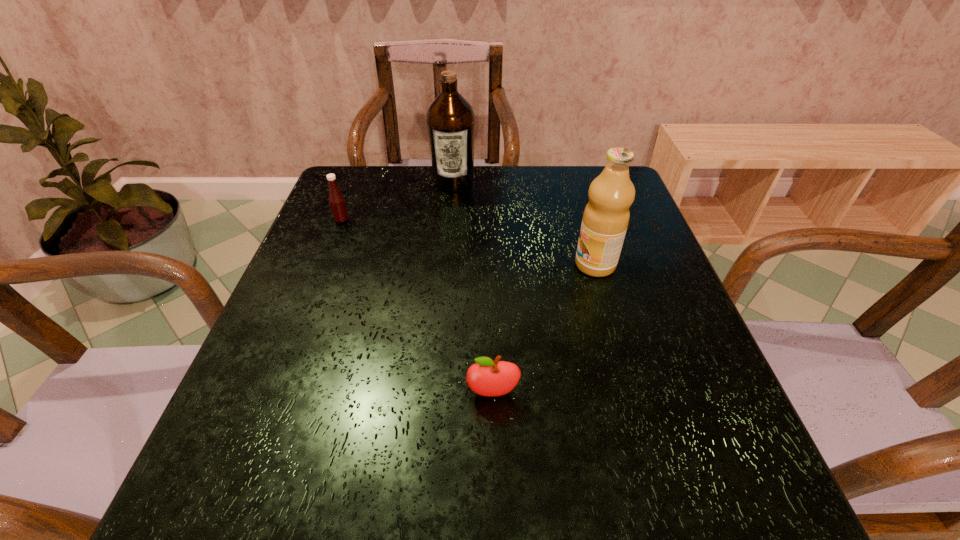
The width and height of the screenshot is (960, 540). I want to click on vacant area between the farthest object and the second shortest object, so click(x=397, y=201).

Where is `free space between the left olive oil and the nearest object`? Image resolution: width=960 pixels, height=540 pixels. free space between the left olive oil and the nearest object is located at coordinates (473, 288).

Find the location of `empty location between the farther olive oil and the third farthest object`. empty location between the farther olive oil and the third farthest object is located at coordinates (524, 224).

Where is `free space between the second farthest object and the rightmost object`? The width and height of the screenshot is (960, 540). free space between the second farthest object and the rightmost object is located at coordinates (468, 242).

Find the location of a particular element. The width and height of the screenshot is (960, 540). object that stands as the closest to the left olive oil is located at coordinates 337,202.

This screenshot has width=960, height=540. In order to click on object that is the closest to the rightmost object in this screenshot , I will do `click(486, 377)`.

The width and height of the screenshot is (960, 540). What are the coordinates of `vacant space that satisfies the following two spatial constraints: 1. on the label of the farther olive oil; 2. on the right side of the nearest object` in the screenshot? It's located at (436, 393).

At what (x,y) coordinates should I click in order to perform the action: click on free space that satisfies the following two spatial constraints: 1. on the label of the shortest object; 2. on the right side of the left olive oil. Please return your answer as a coordinate pair (x, y). Looking at the image, I should click on (436, 393).

Find the location of a particular element. Image resolution: width=960 pixels, height=540 pixels. blank space that satisfies the following two spatial constraints: 1. on the label of the left olive oil; 2. on the right side of the shortest object is located at coordinates (436, 393).